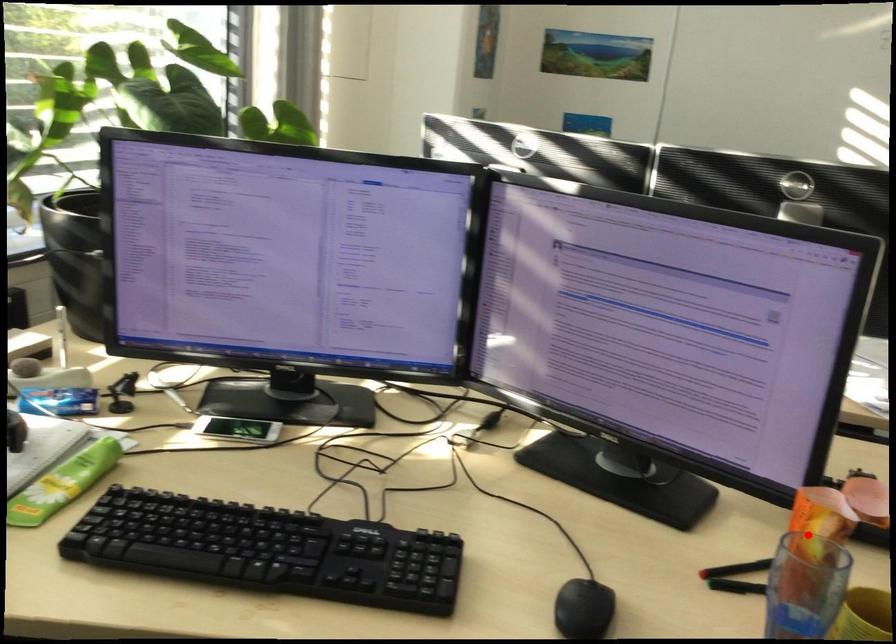
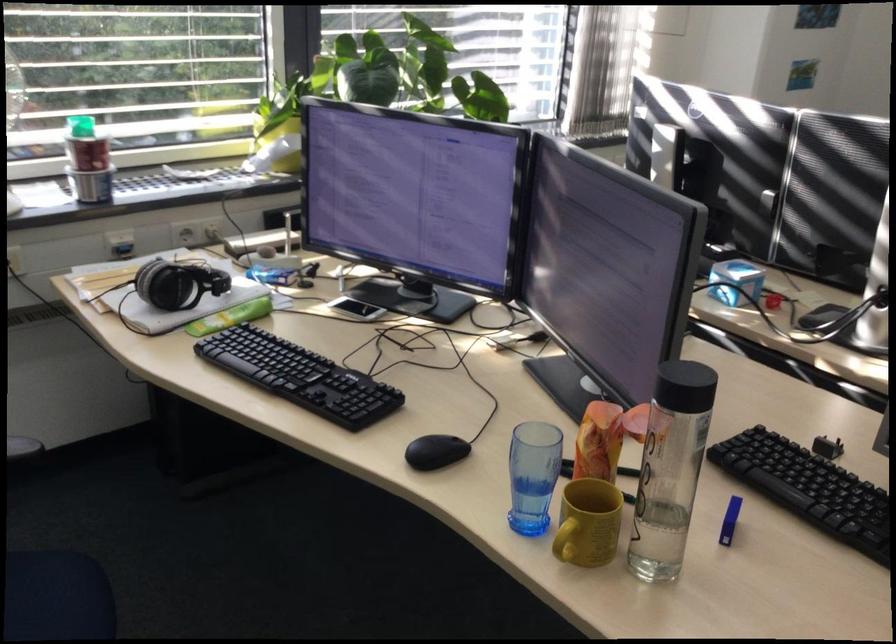
Question: I am providing you with two images of the same scene from different viewpoints. In image1, a red point is highlighted. Considering the same 3D point in image2, which of the following is correct?

Choices:
 (A) It is closer
 (B) It is farther

Answer: (B)